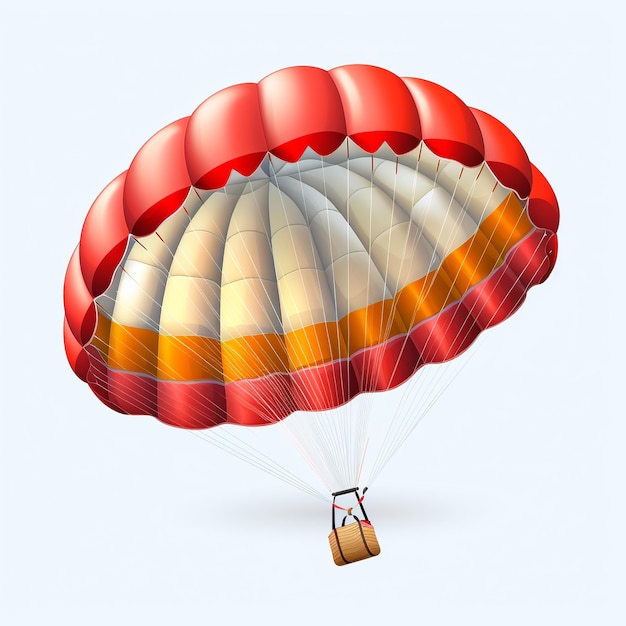
In order to click on cable in this screenshot , I will do `click(327, 429)`.